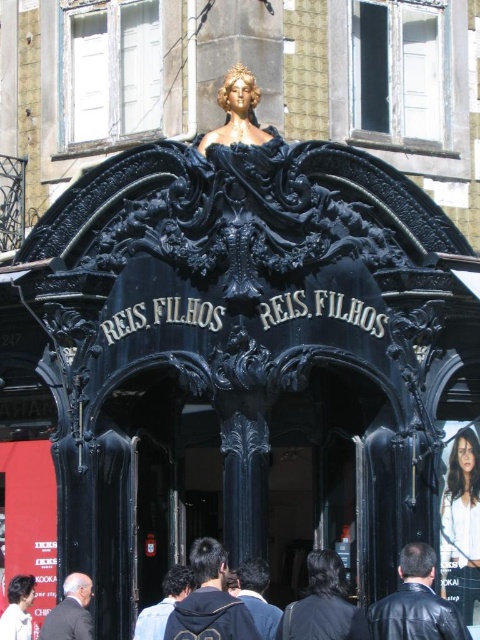
You are standing in front of the entrance and want to touch both points on the archway. Which point should you reach for first, the one at coordinate point (x=315, y=602) or point (x=247, y=596)?

You should reach for point (x=315, y=602) first because it is closer to you than point (x=247, y=596).